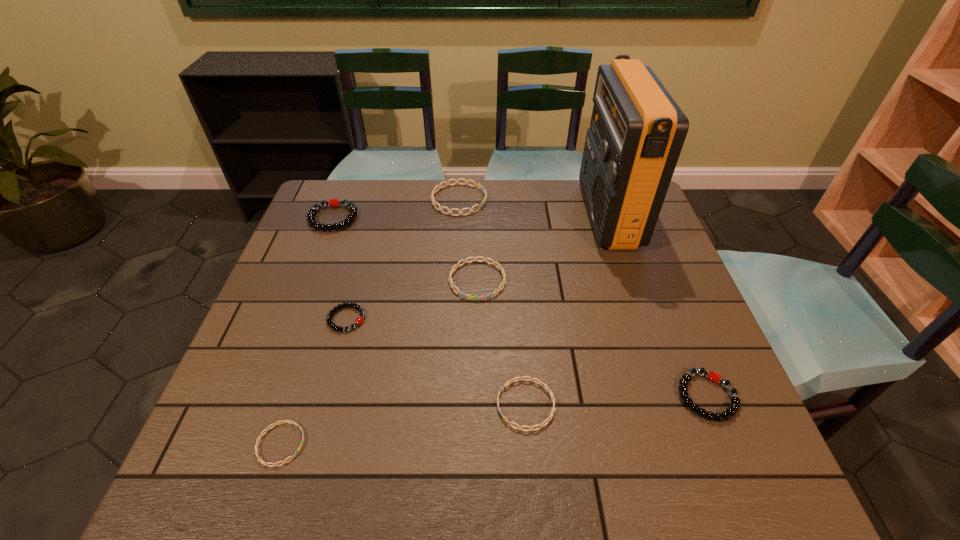
Where is `the smallest black bracelet`? This screenshot has width=960, height=540. the smallest black bracelet is located at coordinates (359, 320).

What are the coordinates of `the shortest bracelet` in the screenshot? It's located at (257, 442).

In order to click on the shortest object in this screenshot , I will do `click(257, 442)`.

Locate an element on the screen. This screenshot has width=960, height=540. free spot located 0.170m on the front-facing side of the radio receiver is located at coordinates (529, 215).

Find the location of `vacant region located 0.190m on the front-facing side of the radio receiver`. vacant region located 0.190m on the front-facing side of the radio receiver is located at coordinates (523, 215).

Image resolution: width=960 pixels, height=540 pixels. Identify the location of vacant space located 0.350m on the front-facing side of the radio receiver. (470, 215).

I want to click on blank area located 0.120m on the surface of the biggest blue bracelet showing star-shaped elements, so click(524, 200).

You are a GUI agent. You are given a task and a screenshot of the screen. Output one action in this format:
    pyautogui.click(x=<x>, y=<y>)
    Task: Click on the free space located on the front of the farthest black bracelet
    
    Given the screenshot: What is the action you would take?
    pyautogui.click(x=314, y=269)

The image size is (960, 540). Identify the location of vacant region located on the surface of the second farthest blue bracelet showing star-shaped elements. (476, 451).

Locate an element on the screen. free location located on the back of the rightmost bracelet is located at coordinates click(671, 308).